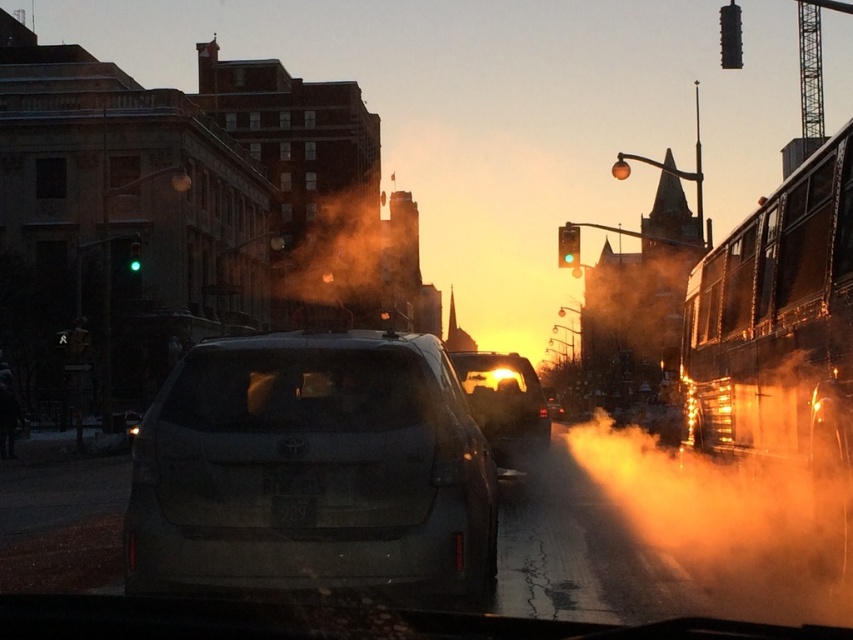
Can you confirm if metallic traffic light at upper right is positioned to the left of green glass traffic light at left?

In fact, metallic traffic light at upper right is to the right of green glass traffic light at left.

Can you confirm if metallic traffic light at upper right is thinner than green glass traffic light at left?

Incorrect, metallic traffic light at upper right's width is not less than green glass traffic light at left's.

Between point (728, 54) and point (128, 262), which one is positioned in front?

Point (728, 54)

The image size is (853, 640). In order to click on metallic traffic light at upper right in this screenshot , I will do `click(730, 35)`.

Does orange foggy steam at center appear over matte gray suv at center?

Yes, orange foggy steam at center is above matte gray suv at center.

Which is in front, point (357, 314) or point (515, 417)?

Positioned in front is point (515, 417).

I want to click on orange foggy steam at center, so click(351, 266).

Can you confirm if transparent glass windshield at center is positioned to the right of green glass traffic light at center?

No, transparent glass windshield at center is not to the right of green glass traffic light at center.

Which is behind, point (210, 376) or point (556, 262)?

Point (556, 262)

Find the location of `transparent glass windshield at center`. transparent glass windshield at center is located at coordinates (297, 388).

Locate an element on the screen. This screenshot has width=853, height=640. transparent glass windshield at center is located at coordinates (297, 388).